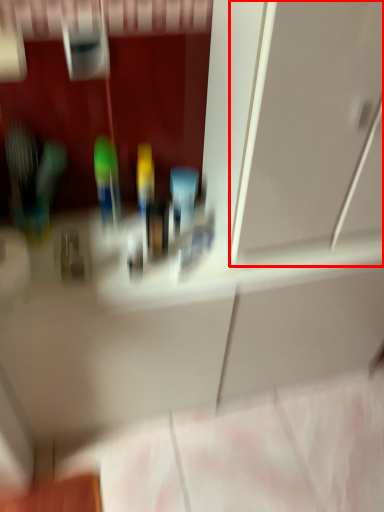
Question: From the image's perspective, what is the correct spatial relationship of glass door (annotated by the red box) in relation to toiletry?

Choices:
 (A) above
 (B) below

Answer: (A)